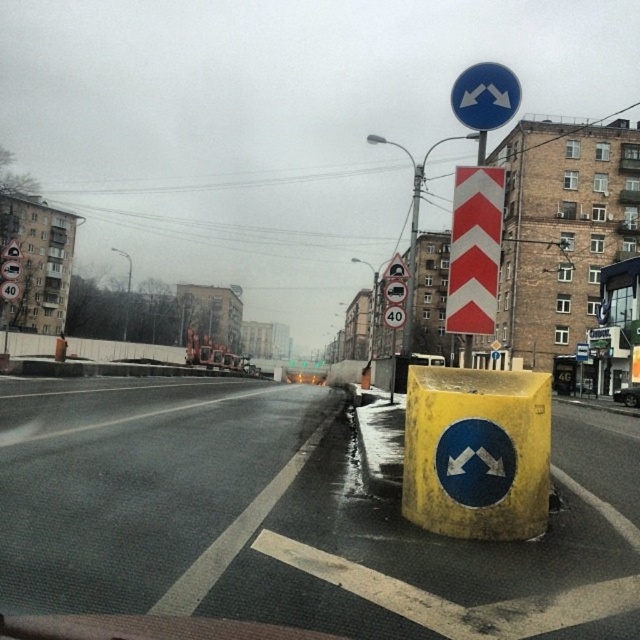
Based on the photo, you are a pedestrian crossing the street and see the metallic rectangular sign at center and the white plastic speed limit sign at center. Which one is placed higher above the road?

The metallic rectangular sign at center is positioned over the white plastic speed limit sign at center, so it is placed higher above the road.

You are a delivery driver approaching the intersection shown in the image. You see a blue glossy traffic sign at upper center located at point [484,97]. What does this sign indicate?

The blue glossy traffic sign at upper center located at point [484,97] indicates a mandatory direction change ahead due to its design with two white arrows pointing downwards.

You are a delivery driver approaching the intersection shown in the image. You see a white reflective chevron at center and a white glossy arrow at lower right. Which of these two objects is bigger?

The white reflective chevron at center is larger in size than the white glossy arrow at lower right.